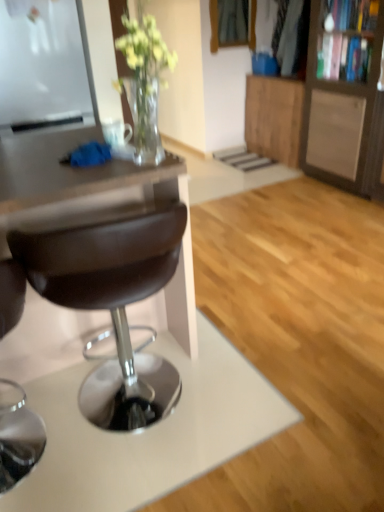
Question: Is wooden cabinet at upper right, placed as the second cabinetry when sorted from front to back, at the left side of brown leather stool at center?

Choices:
 (A) yes
 (B) no

Answer: (B)

Question: Is wooden cabinet at upper right, positioned as the 1th cabinetry in back-to-front order, positioned far away from brown leather stool at center?

Choices:
 (A) yes
 (B) no

Answer: (A)

Question: Is wooden cabinet at upper right, positioned as the 1th cabinetry in back-to-front order, not inside brown leather stool at center?

Choices:
 (A) yes
 (B) no

Answer: (A)

Question: Is wooden cabinet at upper right, placed as the second cabinetry when sorted from front to back, oriented away from brown leather stool at center?

Choices:
 (A) yes
 (B) no

Answer: (B)

Question: Considering the relative sizes of wooden cabinet at upper right, placed as the second cabinetry when sorted from front to back, and brown leather stool at center in the image provided, is wooden cabinet at upper right, placed as the second cabinetry when sorted from front to back, taller than brown leather stool at center?

Choices:
 (A) no
 (B) yes

Answer: (A)

Question: Considering the relative sizes of wooden cabinet at upper right, placed as the second cabinetry when sorted from front to back, and brown leather stool at center in the image provided, is wooden cabinet at upper right, placed as the second cabinetry when sorted from front to back, bigger than brown leather stool at center?

Choices:
 (A) yes
 (B) no

Answer: (A)

Question: Is wooden cabinet at right, arranged as the 1th cabinetry when viewed from the front, at the left side of brown leather stool at center?

Choices:
 (A) yes
 (B) no

Answer: (B)

Question: Considering the relative sizes of wooden cabinet at right, which appears as the 2th cabinetry when viewed from the back, and brown leather stool at center in the image provided, is wooden cabinet at right, which appears as the 2th cabinetry when viewed from the back, bigger than brown leather stool at center?

Choices:
 (A) yes
 (B) no

Answer: (A)

Question: Does wooden cabinet at right, arranged as the 1th cabinetry when viewed from the front, lie in front of brown leather stool at center?

Choices:
 (A) yes
 (B) no

Answer: (B)

Question: Is the depth of wooden cabinet at right, which appears as the 2th cabinetry when viewed from the back, greater than that of brown leather stool at center?

Choices:
 (A) yes
 (B) no

Answer: (A)

Question: Considering the relative sizes of wooden cabinet at right, arranged as the 1th cabinetry when viewed from the front, and brown leather stool at center in the image provided, is wooden cabinet at right, arranged as the 1th cabinetry when viewed from the front, smaller than brown leather stool at center?

Choices:
 (A) yes
 (B) no

Answer: (B)

Question: Does wooden cabinet at right, which appears as the 2th cabinetry when viewed from the back, have a lesser height compared to brown leather stool at center?

Choices:
 (A) yes
 (B) no

Answer: (B)

Question: Can wooden cabinet at upper right, placed as the second cabinetry when sorted from front to back, be found inside wooden cabinet at right, arranged as the 1th cabinetry when viewed from the front?

Choices:
 (A) yes
 (B) no

Answer: (B)